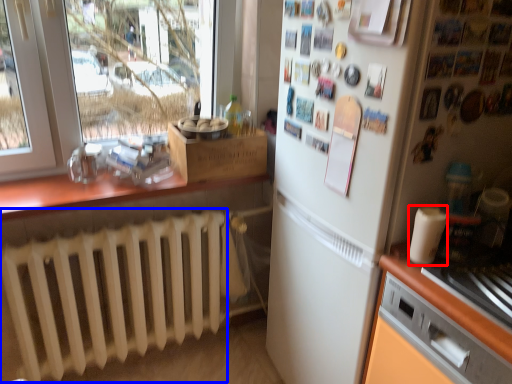
Question: Which object appears closest to the camera in this image, appliance (highlighted by a red box) or radiator (highlighted by a blue box)?

Choices:
 (A) appliance
 (B) radiator

Answer: (A)